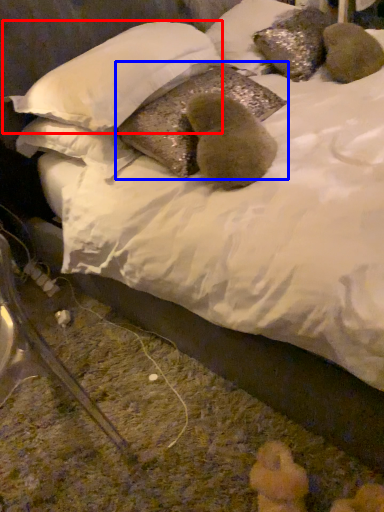
Question: Which of the following is the farthest to the observer, pillow (highlighted by a red box) or pillow (highlighted by a blue box)?

Choices:
 (A) pillow
 (B) pillow

Answer: (B)